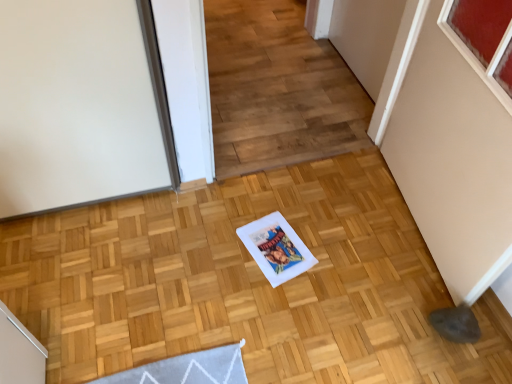
Locate an element on the screen. unoccupied area behind white glossy postcard at center is located at coordinates (276, 206).